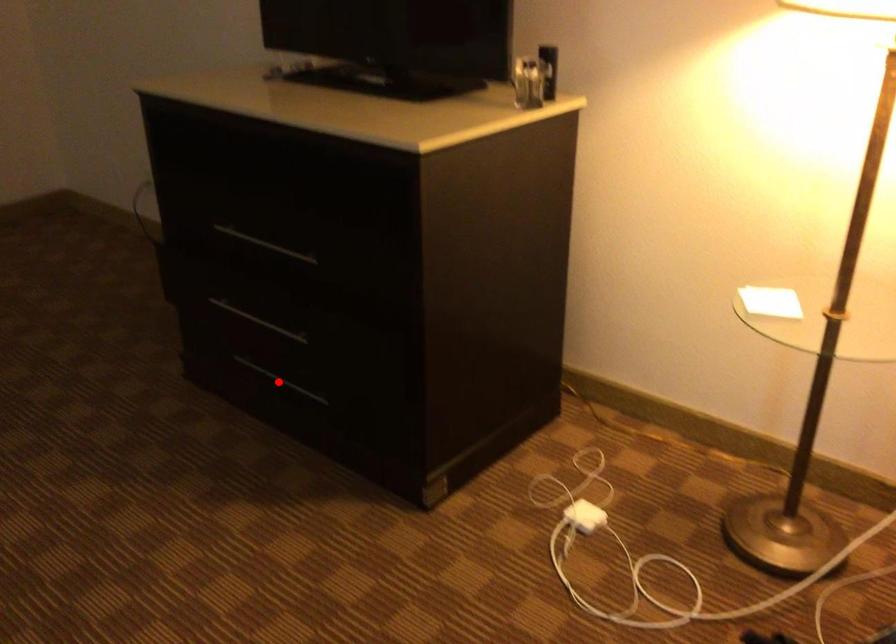
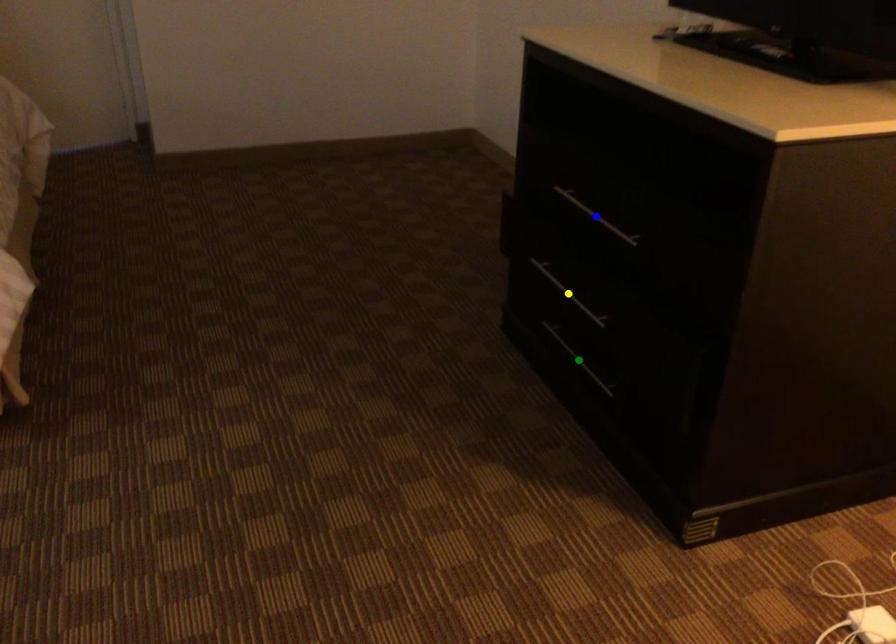
Question: I am providing you with two images of the same scene from different viewpoints. A red point is marked on the first image. You are given multiple points on the second image. Can you choose the point in image 2 that corresponds to the point in image 1?

Choices:
 (A) blue point
 (B) green point
 (C) yellow point

Answer: (B)